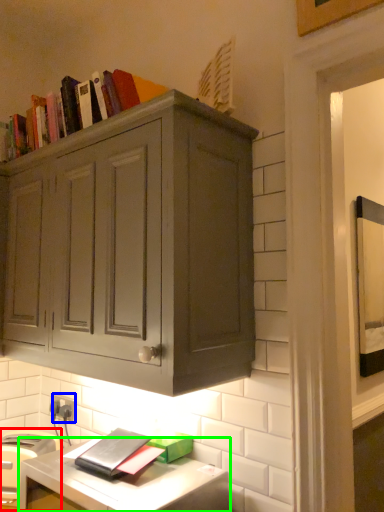
Question: Based on their relative distances, which object is nearer to appliance (highlighted by a red box)? Choose from electric outlet (highlighted by a blue box) and computer desk (highlighted by a green box).

Choices:
 (A) electric outlet
 (B) computer desk

Answer: (B)